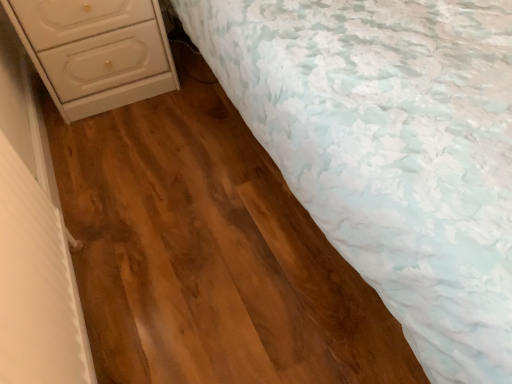
Question: From their relative heights in the image, would you say white floral fabric at upper right is taller or shorter than white glossy chest of drawers at left?

Choices:
 (A) tall
 (B) short

Answer: (A)

Question: Is white floral fabric at upper right in front of or behind white glossy chest of drawers at left in the image?

Choices:
 (A) front
 (B) behind

Answer: (A)

Question: Is white floral fabric at upper right wider or thinner than white glossy chest of drawers at left?

Choices:
 (A) thin
 (B) wide

Answer: (B)

Question: In the image, is white glossy chest of drawers at left on the left side or the right side of white floral fabric at upper right?

Choices:
 (A) left
 (B) right

Answer: (A)

Question: Considering the positions of white glossy chest of drawers at left and white floral fabric at upper right in the image, is white glossy chest of drawers at left wider or thinner than white floral fabric at upper right?

Choices:
 (A) thin
 (B) wide

Answer: (A)

Question: From their relative heights in the image, would you say white glossy chest of drawers at left is taller or shorter than white floral fabric at upper right?

Choices:
 (A) tall
 (B) short

Answer: (B)

Question: From a real-world perspective, is white glossy chest of drawers at left above or below white floral fabric at upper right?

Choices:
 (A) above
 (B) below

Answer: (B)